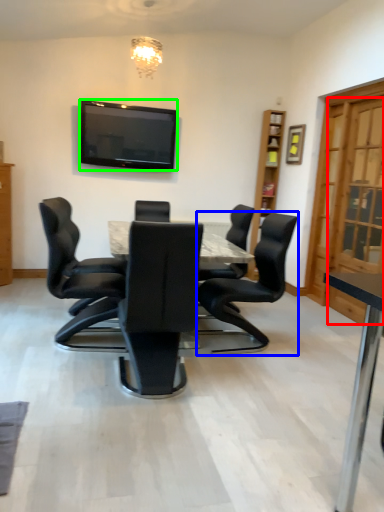
Question: Which object is the farthest from glass door (highlighted by a red box)? Choose among these: chair (highlighted by a blue box) or television (highlighted by a green box).

Choices:
 (A) chair
 (B) television

Answer: (B)